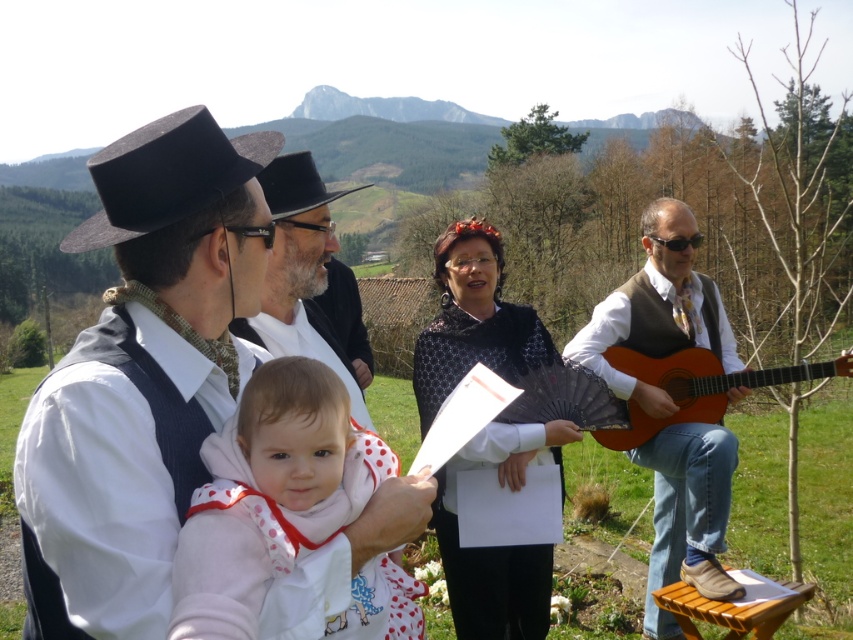
Question: Considering the real-world distances, which object is farthest from the black lace shawl at center?

Choices:
 (A) matte black hat at center
 (B) white polka dot fabric at center

Answer: (A)

Question: Is wooden acoustic guitar at right wider than black felt hat at center?

Choices:
 (A) yes
 (B) no

Answer: (B)

Question: Among these objects, which one is nearest to the camera?

Choices:
 (A) wooden acoustic guitar at right
 (B) matte black hat at center

Answer: (B)

Question: Which point is closer to the camera?

Choices:
 (A) (167, 198)
 (B) (297, 209)

Answer: (A)

Question: Does brown leather guitar at right appear on the left side of black lace shawl at center?

Choices:
 (A) no
 (B) yes

Answer: (A)

Question: Does white polka dot fabric at center appear over black felt dress hat at left?

Choices:
 (A) no
 (B) yes

Answer: (A)